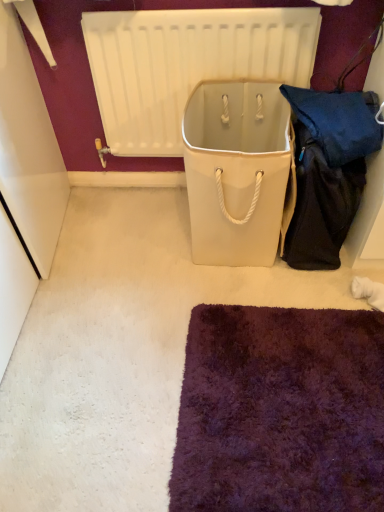
Question: Looking at the image, does white matte radiator at upper center seem bigger or smaller compared to white canvas cooler at center?

Choices:
 (A) small
 (B) big

Answer: (A)

Question: In the image, is white matte radiator at upper center positioned in front of or behind white canvas cooler at center?

Choices:
 (A) front
 (B) behind

Answer: (B)

Question: Do you think white matte radiator at upper center is within white canvas cooler at center, or outside of it?

Choices:
 (A) outside
 (B) inside

Answer: (A)

Question: From their relative heights in the image, would you say white canvas cooler at center is taller or shorter than white matte radiator at upper center?

Choices:
 (A) tall
 (B) short

Answer: (B)

Question: In terms of size, does white canvas cooler at center appear bigger or smaller than white matte radiator at upper center?

Choices:
 (A) small
 (B) big

Answer: (B)

Question: Is white canvas cooler at center spatially inside white matte radiator at upper center, or outside of it?

Choices:
 (A) inside
 (B) outside

Answer: (B)

Question: Is white canvas cooler at center wider or thinner than white matte radiator at upper center?

Choices:
 (A) thin
 (B) wide

Answer: (B)